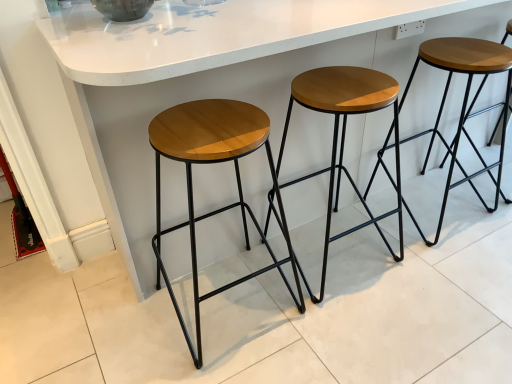
Locate an element on the screen. The width and height of the screenshot is (512, 384). vacant region in front of wooden seat at center, acting as the 3th stool starting from the left is located at coordinates [453, 266].